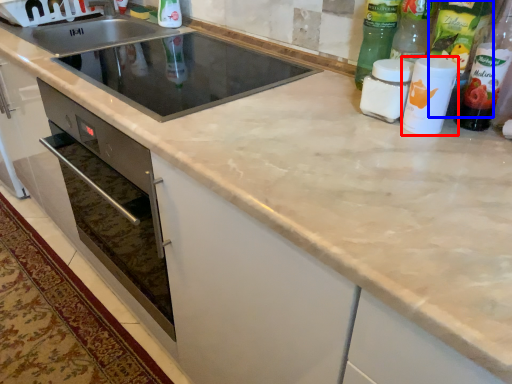
Question: Which object is further to the camera taking this photo, bottle (highlighted by a red box) or bottle (highlighted by a blue box)?

Choices:
 (A) bottle
 (B) bottle

Answer: (B)